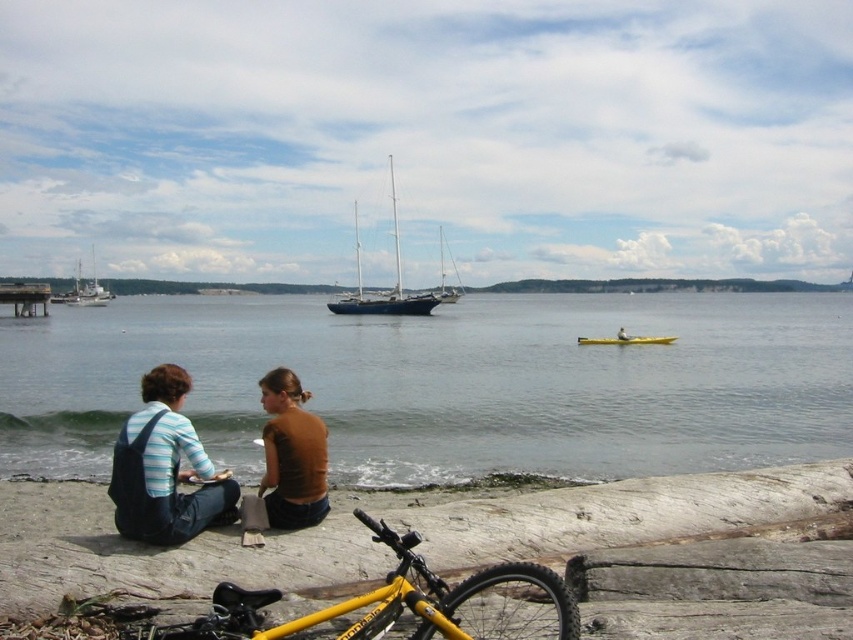
You are a photographer trying to capture both the white matte sailboat at left and the gold metallic kayak at center in a single shot. Based on their positions, which object should you focus on first to ensure both are in frame?

You should focus on the white matte sailboat at left first because the gold metallic kayak at center is behind it, ensuring both will be in the frame when centered on the sailboat.

You are a photographer planning to capture the dark blue polished wood sailboat at center and the wooden dock at left in a single shot. Based on their heights, which object will appear taller in the photograph?

The dark blue polished wood sailboat at center will appear taller in the photograph since it has a greater height compared to the wooden dock at left.

You are standing at the edge of the smooth sand beach at lower left and want to see the yellow matte bicycle at lower center. Is the bicycle visible from your current position?

The yellow matte bicycle at lower center is behind the smooth sand beach at lower left, so it might be partially or fully obstructed from your current viewpoint.